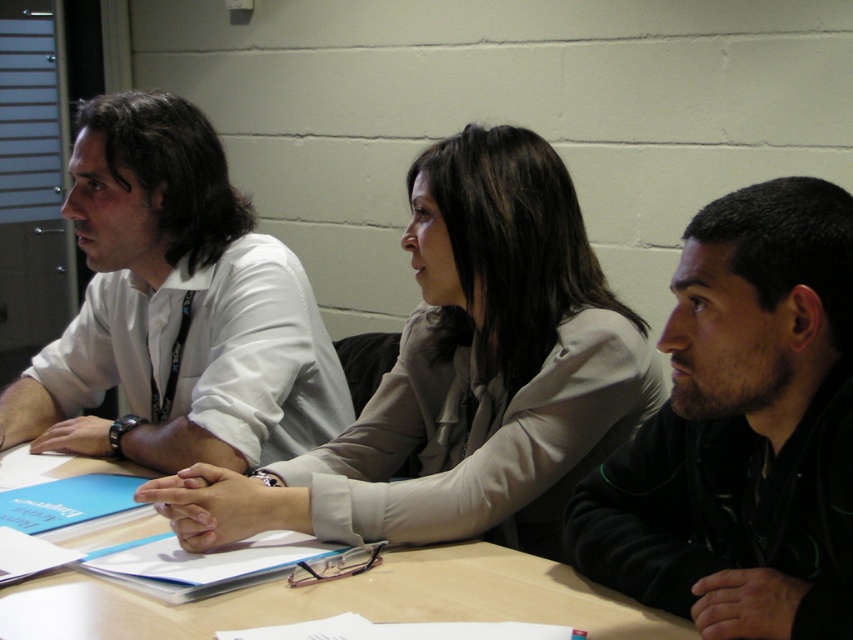
You are sitting at a table with three people. You need to hand a document to the person wearing the light beige fabric jacket at center without disturbing the person in the white shirt at center. How can you do this?

The light beige fabric jacket at center is in front of the white shirt at center. You can slide the document between them towards the light beige fabric jacket at center without moving the white shirt at center.

Looking at this image, you are sitting at the wooden table at center and want to hand a document to the person wearing the light beige fabric jacket at center. Can you reach them directly without moving around the table?

The wooden table at center is behind light beige fabric jacket at center, so you cannot reach them directly without moving around the table.